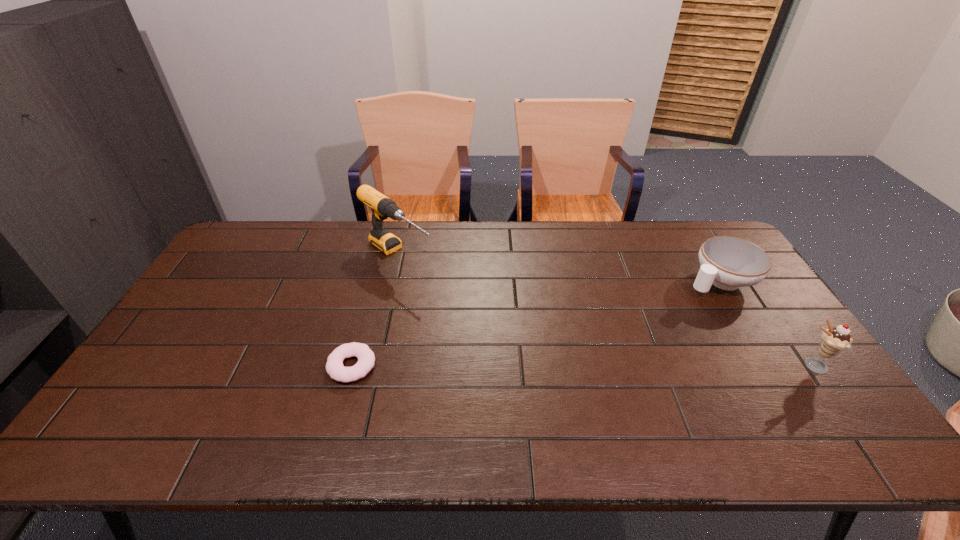
Find the location of `vacant space on the desktop that is between the shortest object and the second tallest object and is positioned on the side with the handle of the third tallest object`. vacant space on the desktop that is between the shortest object and the second tallest object and is positioned on the side with the handle of the third tallest object is located at coordinates (564, 366).

Image resolution: width=960 pixels, height=540 pixels. Identify the location of free space on the desktop that is between the doughnut and the icecream and is positioned on the handle side of the tallest object. (550, 366).